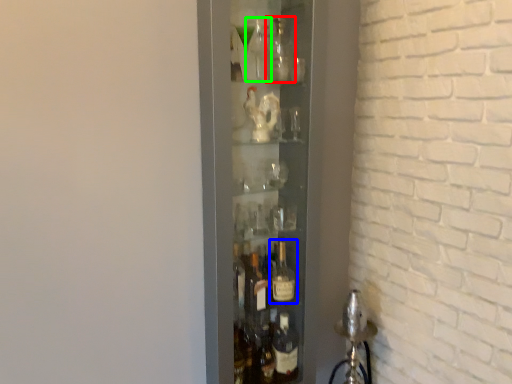
Question: Which object is positioned closest to bottle (highlighted by a red box)? Select from bottle (highlighted by a blue box) and bottle (highlighted by a green box).

Choices:
 (A) bottle
 (B) bottle

Answer: (B)